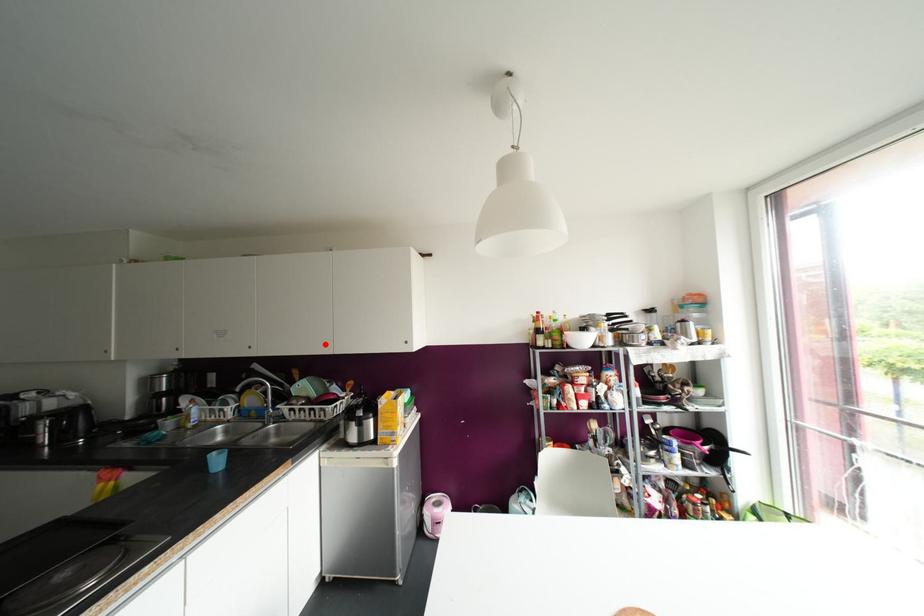
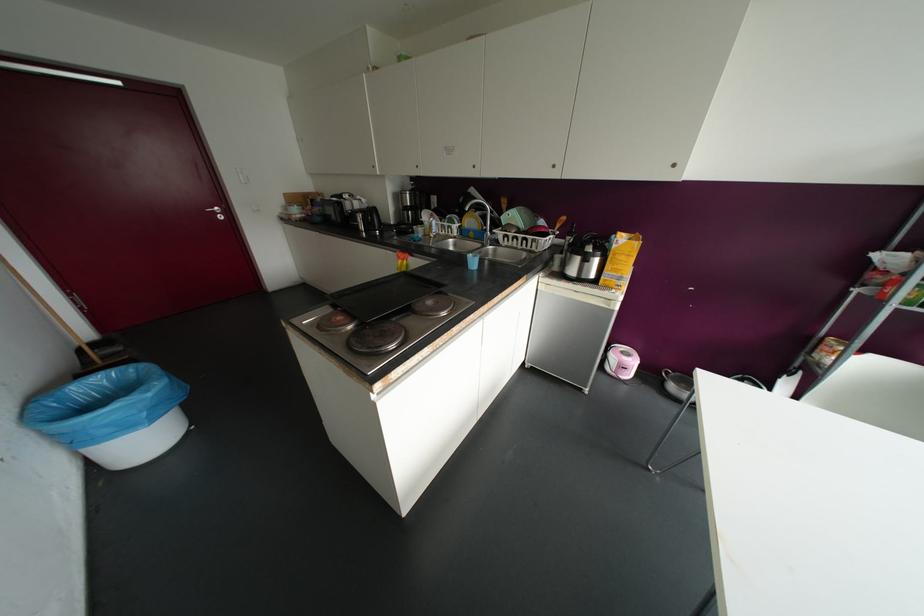
Where in the second image is the point corresponding to the highlighted location from the first image?

(553, 166)